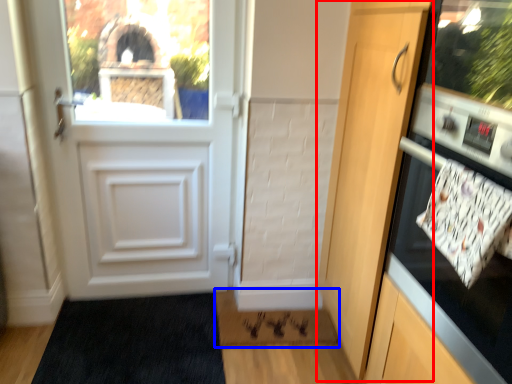
Question: Which of the following is the farthest to the observer, door (highlighted by a red box) or doormat (highlighted by a blue box)?

Choices:
 (A) door
 (B) doormat

Answer: (B)